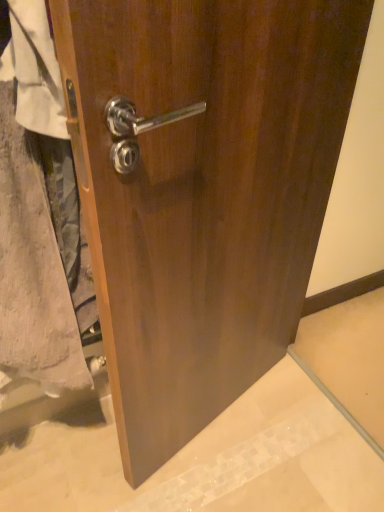
Where is `white fabric at left`? white fabric at left is located at coordinates (39, 214).

The width and height of the screenshot is (384, 512). What do you see at coordinates (39, 214) in the screenshot? I see `white fabric at left` at bounding box center [39, 214].

Find the location of a particular element. This screenshot has width=384, height=512. white fabric at left is located at coordinates (39, 214).